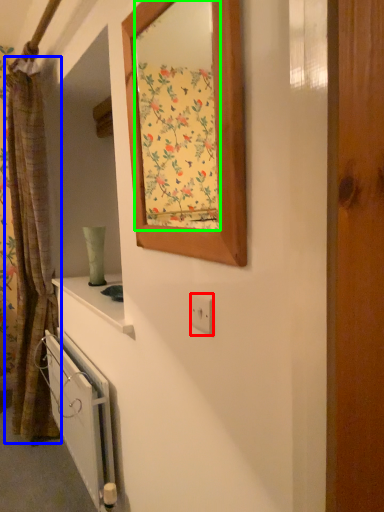
Question: Which is farther away from electric outlet (highlighted by a red box)? curtain (highlighted by a blue box) or mirror (highlighted by a green box)?

Choices:
 (A) curtain
 (B) mirror

Answer: (B)